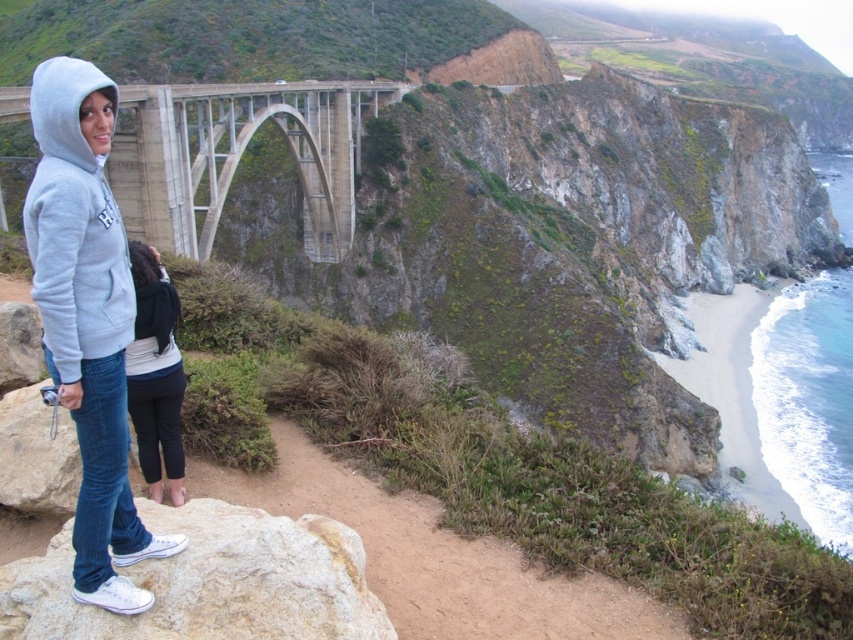
You are standing on the rocky outcrop and want to move towards the bridge. Which point, point (218, 136) or point (108, 355), is closer to you as you face the bridge?

Point (218, 136) is closer to you because it is further to the viewer than point (108, 355), meaning it is nearer in your current position facing the bridge.

You are a hiker who wants to take a photo of the gray fleece hoodie at left from the point marked as point (74, 225). Can you do that?

Yes, because the point (74, 225) marks the location of the gray fleece hoodie at left, so you can take a photo of it from there.